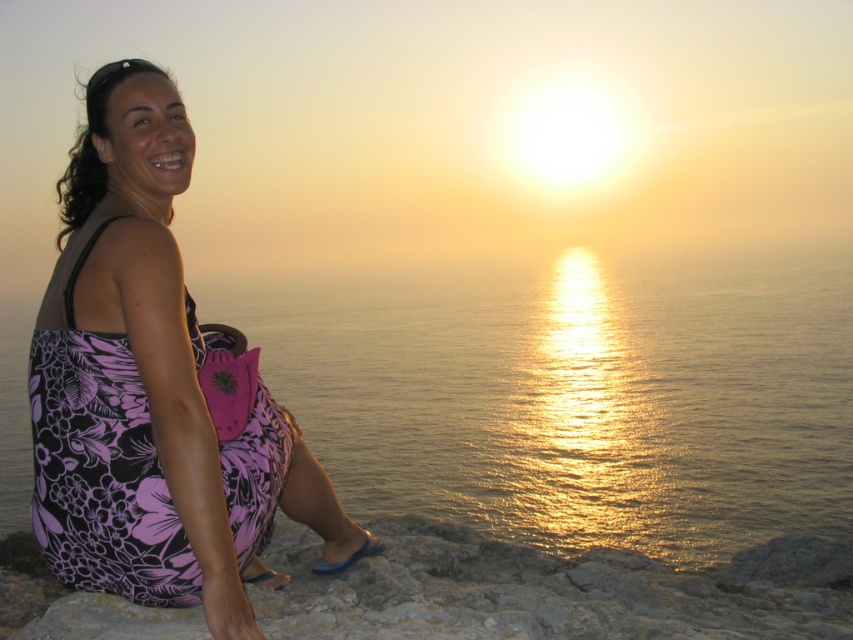
Who is lower down, golden reflective water at center or floral dress at left?

floral dress at left

Can you confirm if golden reflective water at center is thinner than floral dress at left?

No, golden reflective water at center is not thinner than floral dress at left.

What are the coordinates of `golden reflective water at center` in the screenshot? It's located at (578, 397).